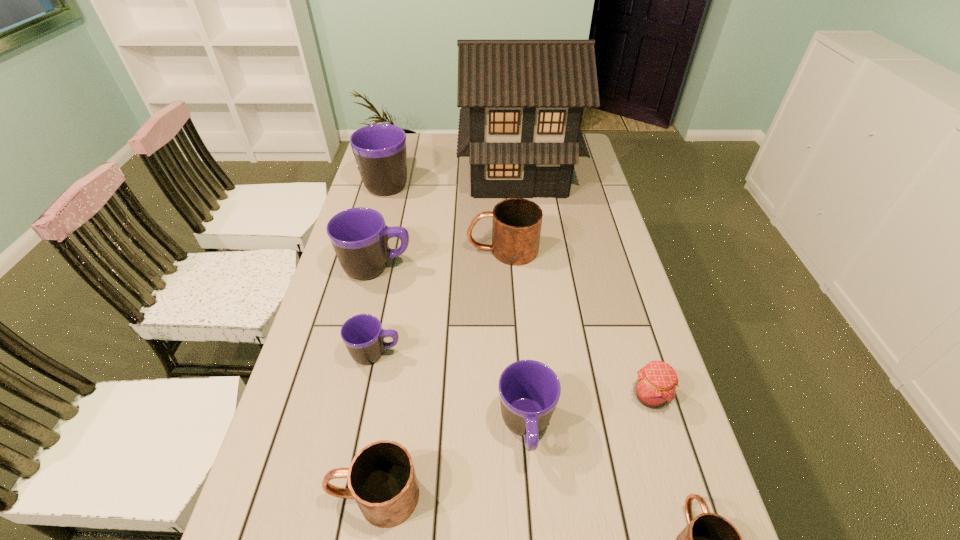
Where is `object that is the eighth closest one to the tallest object`? object that is the eighth closest one to the tallest object is located at coordinates (709, 539).

Select which mug is the second closest to the nearest black mug. Please provide its 2D coordinates. Your answer should be formatted as a tuple, i.e. [(x, y)], where the tuple contains the x and y coordinates of a point satisfying the conditions above.

[(709, 539)]

At what (x,y) coordinates should I click in order to perform the action: click on mug that is the sixth nearest to the second rust mug from right to left. Please return your answer as a coordinate pair (x, y). Looking at the image, I should click on (709, 539).

Point out which black mug is positioned as the second nearest to the rightmost mug. Please provide its 2D coordinates. Your answer should be formatted as a tuple, i.e. [(x, y)], where the tuple contains the x and y coordinates of a point satisfying the conditions above.

[(363, 335)]

Where is `black mug that is the closest to the second nearest black mug`? The width and height of the screenshot is (960, 540). black mug that is the closest to the second nearest black mug is located at coordinates (359, 236).

This screenshot has width=960, height=540. What are the coordinates of `rust mug that is the closest to the red jam` in the screenshot? It's located at (709, 539).

Locate which rust mug is the second closest to the third smallest black mug. Please provide its 2D coordinates. Your answer should be formatted as a tuple, i.e. [(x, y)], where the tuple contains the x and y coordinates of a point satisfying the conditions above.

[(381, 478)]

The height and width of the screenshot is (540, 960). Identify the location of free space that satisfies the following two spatial constraints: 1. with the handle on the side of the third biggest black mug; 2. on the side of the leftmost rust mug with the handle. (531, 496).

I want to click on free space that satisfies the following two spatial constraints: 1. on the front-facing side of the black dollhouse; 2. with the handle on the side of the smallest black mug, so click(538, 354).

This screenshot has width=960, height=540. I want to click on free location that satisfies the following two spatial constraints: 1. with the handle on the side of the jam; 2. on the left side of the smallest black mug, so click(x=368, y=396).